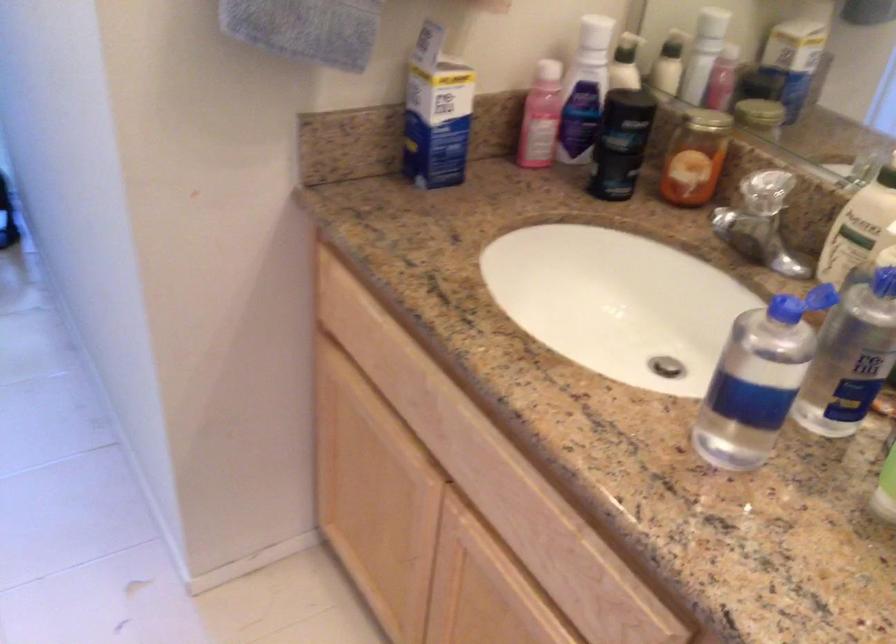
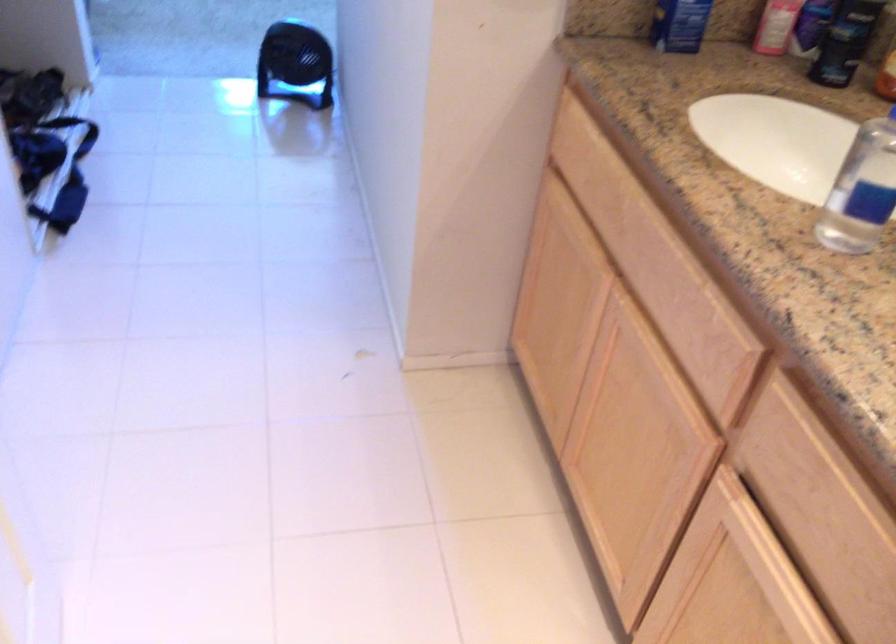
What movement of the cameraman would produce the second image?

The cameraman moved toward right, backward.